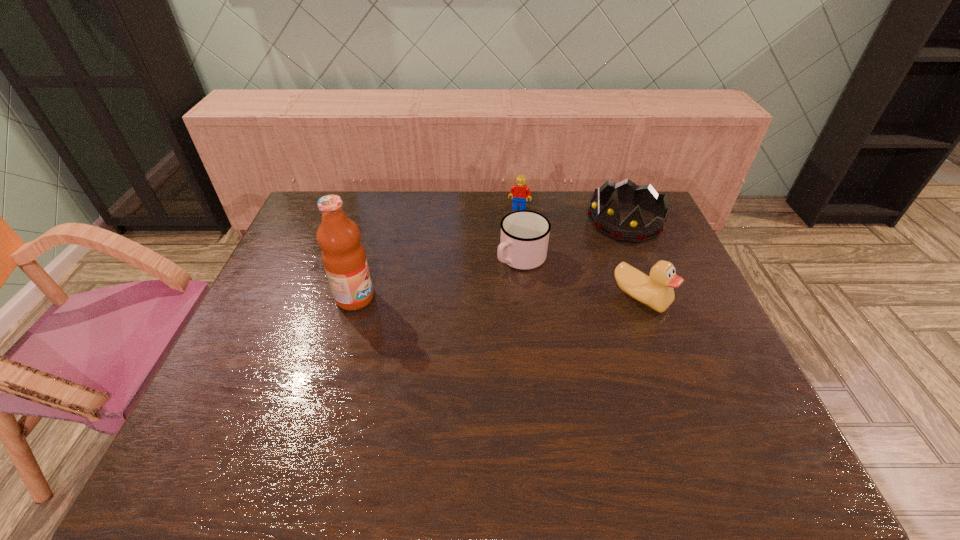
Image resolution: width=960 pixels, height=540 pixels. In order to click on tiara that is at the right edge in this screenshot , I will do `click(632, 229)`.

Image resolution: width=960 pixels, height=540 pixels. Find the location of `object situated at the far right corner`. object situated at the far right corner is located at coordinates (632, 229).

This screenshot has width=960, height=540. Find the location of `vacant space at the far edge`. vacant space at the far edge is located at coordinates (563, 222).

Where is `free spot at the near edge of the desktop`? free spot at the near edge of the desktop is located at coordinates (x=295, y=397).

Locate an element on the screen. Image resolution: width=960 pixels, height=540 pixels. vacant space at the left edge is located at coordinates click(320, 294).

Image resolution: width=960 pixels, height=540 pixels. What are the coordinates of `free space at the right edge` in the screenshot? It's located at (664, 312).

Identify the location of vacant space at the far left corner. This screenshot has height=540, width=960. (349, 212).

The height and width of the screenshot is (540, 960). Find the location of `vacant area that lies between the Lego and the leftmost object`. vacant area that lies between the Lego and the leftmost object is located at coordinates (437, 253).

At what (x,y) coordinates should I click in order to perform the action: click on blank region between the mug and the tiara. Please return your answer as a coordinate pair (x, y). This screenshot has width=960, height=540. Looking at the image, I should click on (573, 240).

Where is `vacant space that is in between the fruit juice and the mug`? This screenshot has width=960, height=540. vacant space that is in between the fruit juice and the mug is located at coordinates (439, 278).